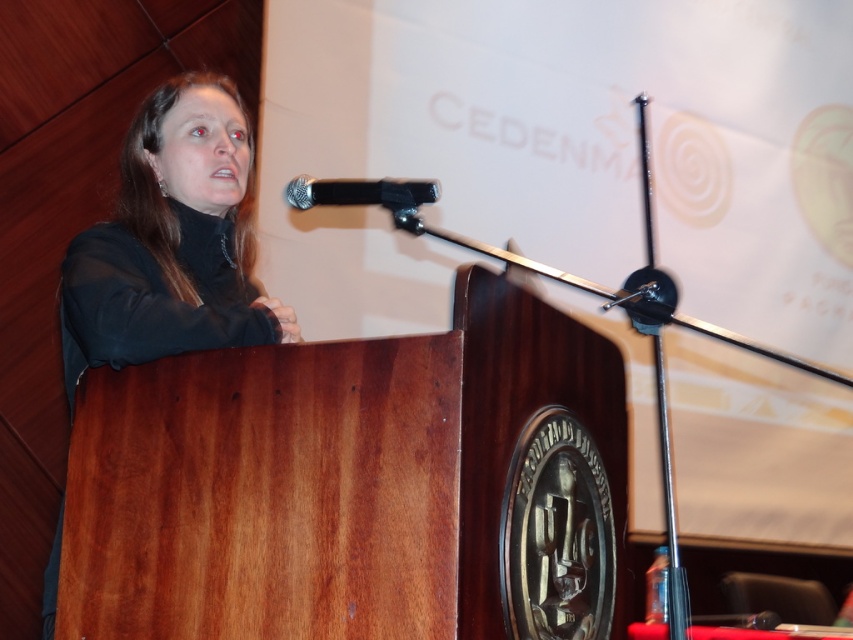
Question: Which point is farther to the camera?

Choices:
 (A) black matte microphone at upper center
 (B) black matte/tacky sweater at upper left

Answer: (B)

Question: Is black matte/tacky sweater at upper left bigger than black matte microphone at upper center?

Choices:
 (A) no
 (B) yes

Answer: (B)

Question: Which point is closer to the camera taking this photo?

Choices:
 (A) (51, 627)
 (B) (352, 192)

Answer: (B)

Question: Is black matte/tacky sweater at upper left to the right of black matte microphone at upper center from the viewer's perspective?

Choices:
 (A) yes
 (B) no

Answer: (B)

Question: Is black matte/tacky sweater at upper left wider than black matte microphone at upper center?

Choices:
 (A) no
 (B) yes

Answer: (B)